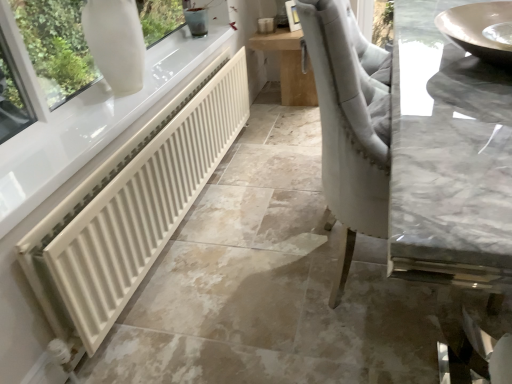
The width and height of the screenshot is (512, 384). Describe the element at coordinates (289, 66) in the screenshot. I see `wooden table at center` at that location.

Image resolution: width=512 pixels, height=384 pixels. What do you see at coordinates (132, 206) in the screenshot?
I see `white matte radiator at lower left` at bounding box center [132, 206].

Describe the element at coordinates (56, 47) in the screenshot. I see `white glossy vase at upper left` at that location.

In order to face matte gray sink at upper right, should I rotate leftwards or rightwards?

Rotate right and turn 27.965 degrees.

You are a GUI agent. You are given a task and a screenshot of the screen. Output one action in this format:
    pyautogui.click(x=<x>, y=<y>)
    Task: Click on the wooden table at center
    
    Given the screenshot: What is the action you would take?
    point(289,66)

Can you confirm if white glossy vase at upper left is bigger than matte gray sink at upper right?

Yes.

From a real-world perspective, between white glossy vase at upper left and matte gray sink at upper right, who is vertically higher?

In real-world perspective, white glossy vase at upper left is above.

Would you consider matte gray sink at upper right to be distant from wooden table at center?

Indeed, matte gray sink at upper right is not near wooden table at center.

Considering the positions of objects matte gray sink at upper right and wooden table at center in the image provided, who is in front, matte gray sink at upper right or wooden table at center?

matte gray sink at upper right is more forward.

Based on the photo, is matte gray sink at upper right to the left of wooden table at center from the viewer's perspective?

No.

Between white matte radiator at lower left and white glossy vase at upper left, which one has more height?

white matte radiator at lower left is taller.

From a real-world perspective, between white matte radiator at lower left and white glossy vase at upper left, who is vertically higher?

white glossy vase at upper left, from a real-world perspective.

Does white matte radiator at lower left have a lesser width compared to white glossy vase at upper left?

Indeed, white matte radiator at lower left has a lesser width compared to white glossy vase at upper left.

Is white matte radiator at lower left behind white glossy vase at upper left?

No, it is not.

From the picture: How different are the orientations of white matte radiator at lower left and matte gray sink at upper right in degrees?

0.432 degrees separate the facing orientations of white matte radiator at lower left and matte gray sink at upper right.

From the image's perspective, which one is positioned higher, white matte radiator at lower left or matte gray sink at upper right?

matte gray sink at upper right is shown above in the image.

In terms of height, does white matte radiator at lower left look taller or shorter compared to matte gray sink at upper right?

Clearly, white matte radiator at lower left is taller compared to matte gray sink at upper right.

Which object is wider, white matte radiator at lower left or matte gray sink at upper right?

With larger width is matte gray sink at upper right.

Based on their positions, is wooden table at center located to the left or right of white matte radiator at lower left?

From the image, it's evident that wooden table at center is to the right of white matte radiator at lower left.

Is white matte radiator at lower left surrounded by wooden table at center?

No, wooden table at center does not contain white matte radiator at lower left.

How different are the orientations of wooden table at center and white matte radiator at lower left in degrees?

0.432 degrees separate the facing orientations of wooden table at center and white matte radiator at lower left.

From the image's perspective, is wooden table at center on white matte radiator at lower left?

Yes, from the image's perspective, wooden table at center is on top of white matte radiator at lower left.

From the image's perspective, which is below, wooden table at center or white glossy vase at upper left?

white glossy vase at upper left is shown below in the image.

Between wooden table at center and white glossy vase at upper left, which one has more height?

With more height is wooden table at center.

Could you tell me if wooden table at center is facing white glossy vase at upper left?

No, wooden table at center is not aimed at white glossy vase at upper left.

Is white matte radiator at lower left completely or partially inside matte gray sink at upper right?

No, white matte radiator at lower left is not a part of matte gray sink at upper right.

From the image's perspective, which one is positioned lower, matte gray sink at upper right or white matte radiator at lower left?

white matte radiator at lower left is shown below in the image.

Locate an element on the screen. The width and height of the screenshot is (512, 384). radiator below the matte gray sink at upper right (from the image's perspective) is located at coordinates (132, 206).

Can you confirm if matte gray sink at upper right is bigger than white matte radiator at lower left?

No, matte gray sink at upper right is not bigger than white matte radiator at lower left.

Where is `window that is on the left side of matte gray sink at upper right`? Image resolution: width=512 pixels, height=384 pixels. window that is on the left side of matte gray sink at upper right is located at coordinates (56, 47).

I want to click on table below the matte gray sink at upper right (from a real-world perspective), so click(289, 66).

Considering their positions, is matte gray sink at upper right positioned further to white matte radiator at lower left than white glossy vase at upper left?

The object further to white matte radiator at lower left is matte gray sink at upper right.

Considering their positions, is wooden table at center positioned further to matte gray sink at upper right than white matte radiator at lower left?

Based on the image, wooden table at center appears to be further to matte gray sink at upper right.

Looking at the image, which one is located further to matte gray sink at upper right, white glossy vase at upper left or wooden table at center?

Based on the image, wooden table at center appears to be further to matte gray sink at upper right.

When comparing their distances from white matte radiator at lower left, does matte gray sink at upper right or wooden table at center seem closer?

matte gray sink at upper right is closer to white matte radiator at lower left.

Estimate the real-world distances between objects in this image. Which object is further from white matte radiator at lower left, wooden table at center or matte gray sink at upper right?

Based on the image, wooden table at center appears to be further to white matte radiator at lower left.

Based on their spatial positions, is white glossy vase at upper left or white matte radiator at lower left closer to matte gray sink at upper right?

Among the two, white matte radiator at lower left is located nearer to matte gray sink at upper right.

Estimate the real-world distances between objects in this image. Which object is further from white glossy vase at upper left, matte gray sink at upper right or white matte radiator at lower left?

Based on the image, matte gray sink at upper right appears to be further to white glossy vase at upper left.

In the scene shown: Based on their spatial positions, is white matte radiator at lower left or white glossy vase at upper left further from matte gray sink at upper right?

white glossy vase at upper left lies further to matte gray sink at upper right than the other object.

Where is `window located between matte gray sink at upper right and wooden table at center in the depth direction`? The image size is (512, 384). window located between matte gray sink at upper right and wooden table at center in the depth direction is located at coordinates (56, 47).

At what (x,y) coordinates should I click in order to perform the action: click on window positioned between white matte radiator at lower left and wooden table at center from near to far. Please return your answer as a coordinate pair (x, y). The height and width of the screenshot is (384, 512). Looking at the image, I should click on (56, 47).

Where is `radiator between matte gray sink at upper right and wooden table at center in the front-back direction`? radiator between matte gray sink at upper right and wooden table at center in the front-back direction is located at coordinates (132, 206).

In order to click on radiator between white glossy vase at upper left and matte gray sink at upper right from left to right in this screenshot , I will do `click(132, 206)`.